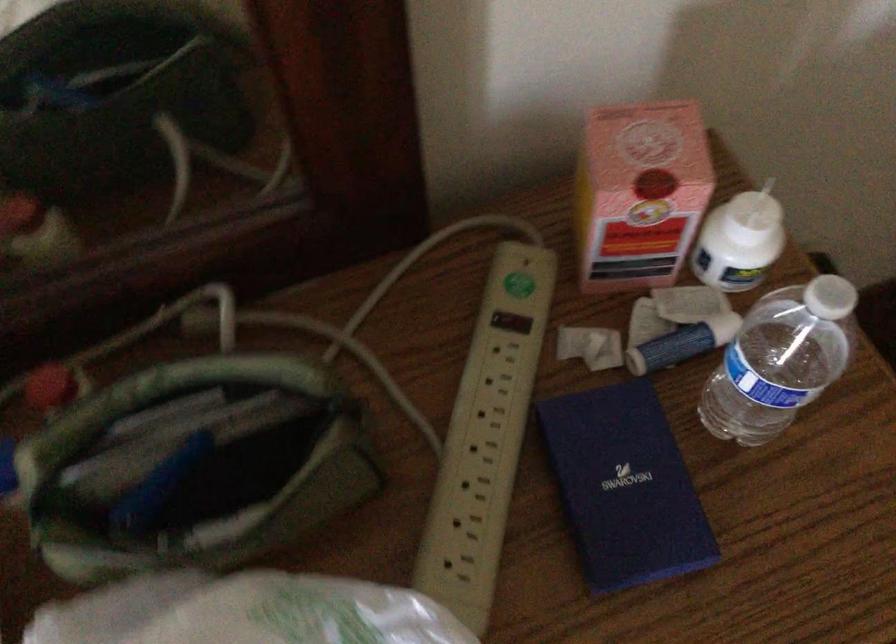
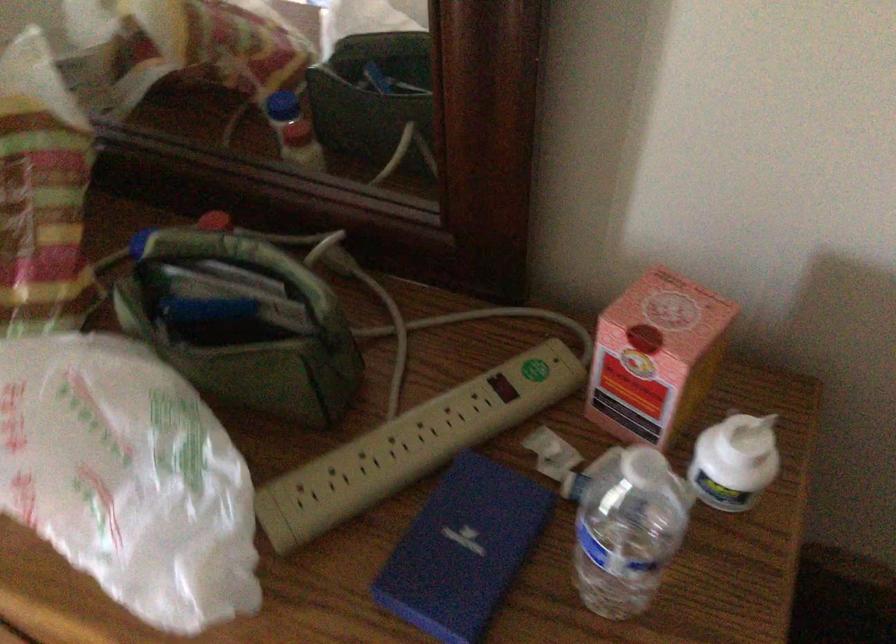
The point at [515,325] is marked in the first image. Where is the corresponding point in the second image?

(503, 386)